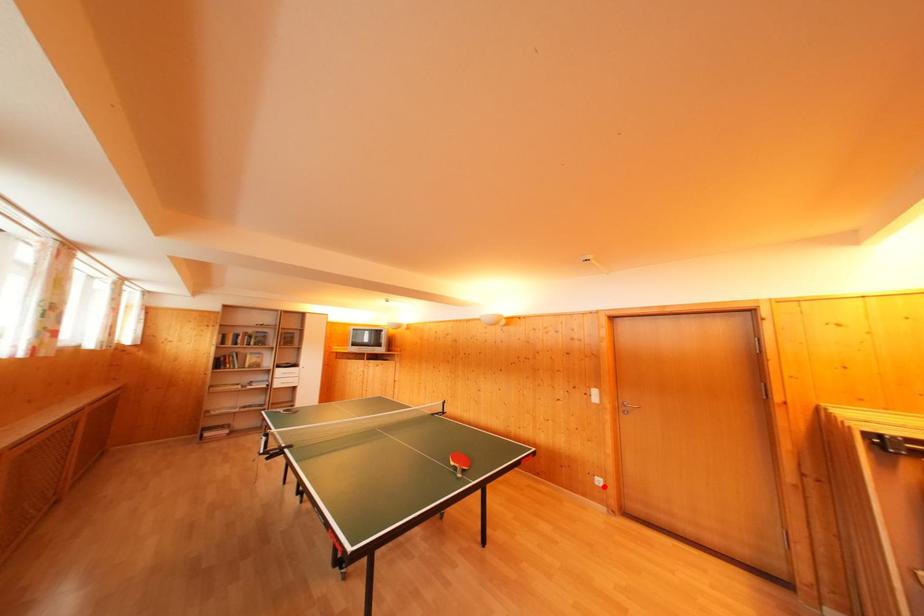
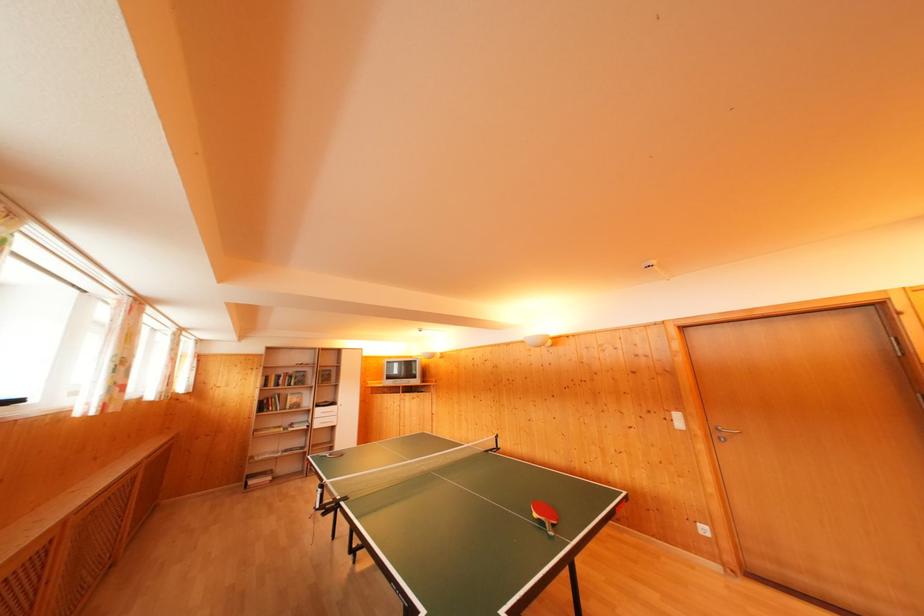
In the second image, find the point that corresponds to the highlighted location in the first image.

(709, 535)